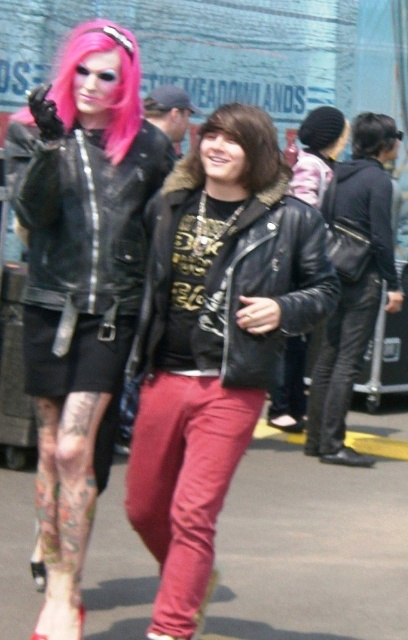
Question: Estimate the real-world distances between objects in this image. Which object is farther from the matte black leather jacket at left?

Choices:
 (A) black leather jacket at right
 (B) clear plastic goggles at upper left
 (C) pink synthetic wig at upper left
 (D) brownhair at center

Answer: (A)

Question: Which point is closer to the camera taking this photo?

Choices:
 (A) (372, 152)
 (B) (392, 291)
 (C) (126, 38)

Answer: (C)

Question: Is brownhair at center above clear plastic goggles at upper left?

Choices:
 (A) no
 (B) yes

Answer: (A)

Question: Estimate the real-world distances between objects in this image. Which object is closer to the matte black leather jacket at left?

Choices:
 (A) matte black leather jacket at center
 (B) clear plastic goggles at upper left
 (C) brownhair at center
 (D) leather jacket at center

Answer: (D)

Question: Does matte black leather jacket at left have a smaller size compared to black matte hair at upper right?

Choices:
 (A) yes
 (B) no

Answer: (B)

Question: Can you confirm if pink synthetic wig at upper left is smaller than clear plastic goggles at upper left?

Choices:
 (A) yes
 (B) no

Answer: (B)